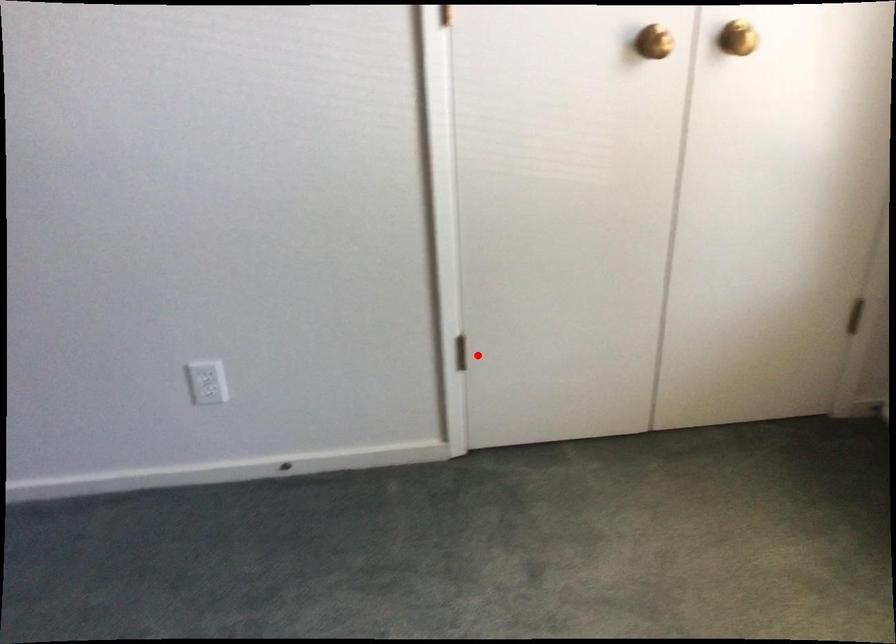
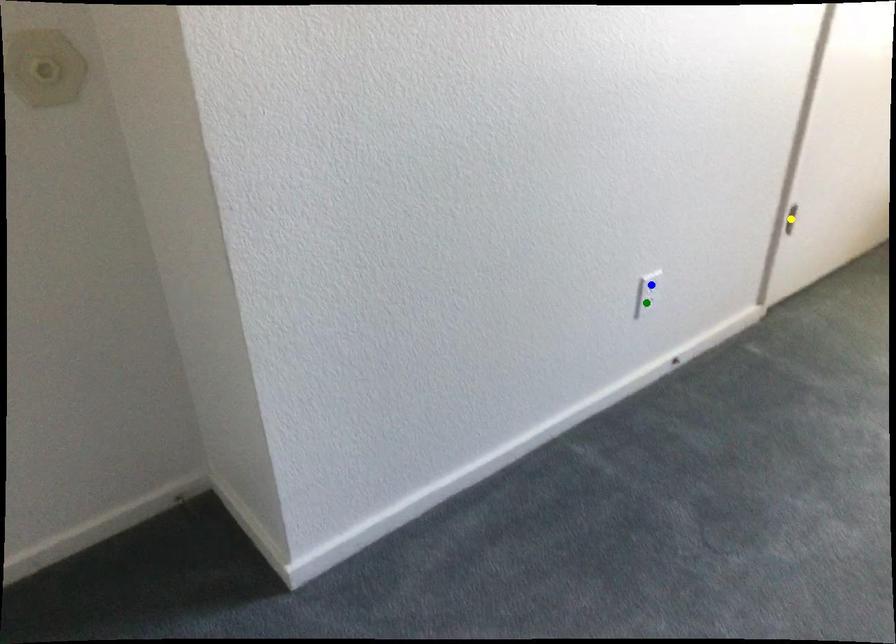
Question: I am providing you with two images of the same scene from different viewpoints. A red point is marked on the first image. You are given multiple points on the second image. Can you choose the point in image 2 that corresponds to the point in image 1?

Choices:
 (A) blue point
 (B) yellow point
 (C) green point

Answer: (B)